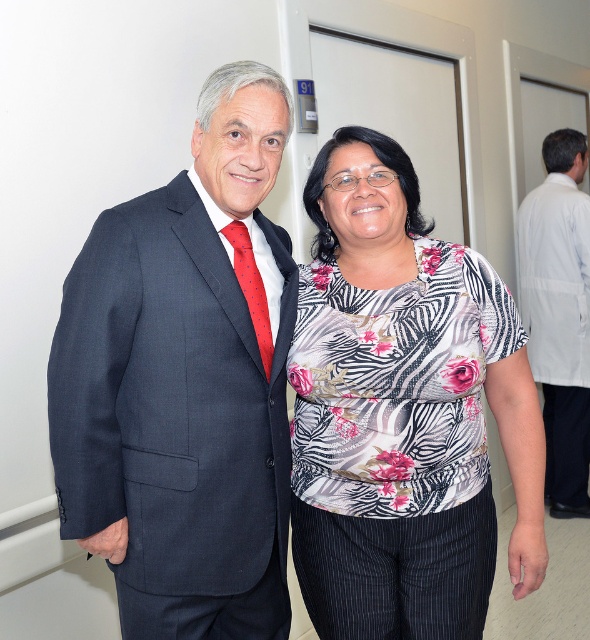
Question: Considering the relative positions of floral printed blouse at center and red dotted fabric tie at left in the image provided, where is floral printed blouse at center located with respect to red dotted fabric tie at left?

Choices:
 (A) right
 (B) left

Answer: (A)

Question: Which point is closer to the camera?

Choices:
 (A) (86, 522)
 (B) (417, 365)
 (C) (267, 380)

Answer: (A)

Question: Does dark blue textured suit at left appear over red dotted fabric tie at left?

Choices:
 (A) no
 (B) yes

Answer: (A)

Question: Which of the following is the farthest from the observer?

Choices:
 (A) dark blue textured suit at left
 (B) red dotted fabric tie at left

Answer: (B)

Question: Does white lab coat at right have a lesser width compared to red dotted fabric tie at left?

Choices:
 (A) yes
 (B) no

Answer: (B)

Question: Which object is positioned farthest from the white lab coat at right?

Choices:
 (A) red dotted fabric tie at left
 (B) dark blue textured suit at left
 (C) floral printed blouse at center

Answer: (B)